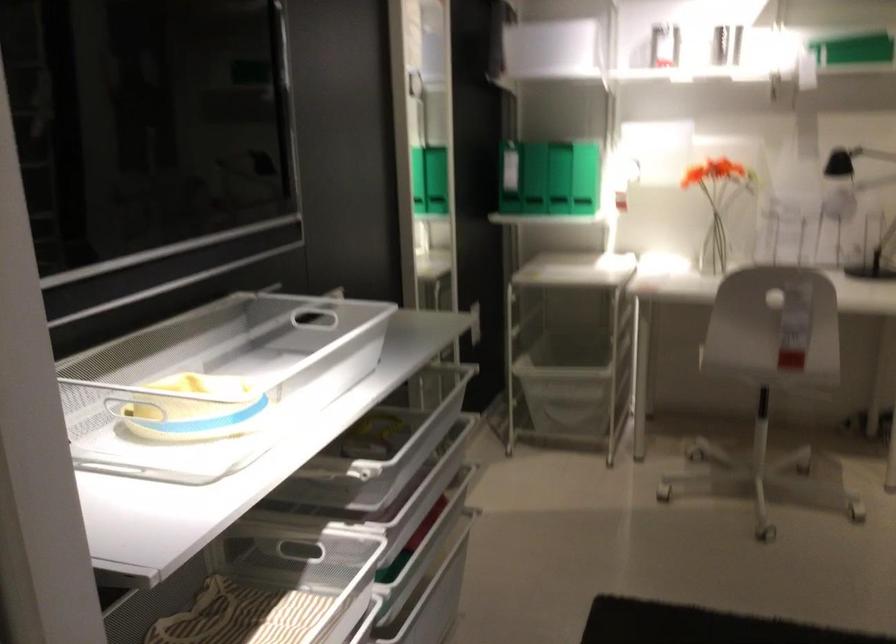
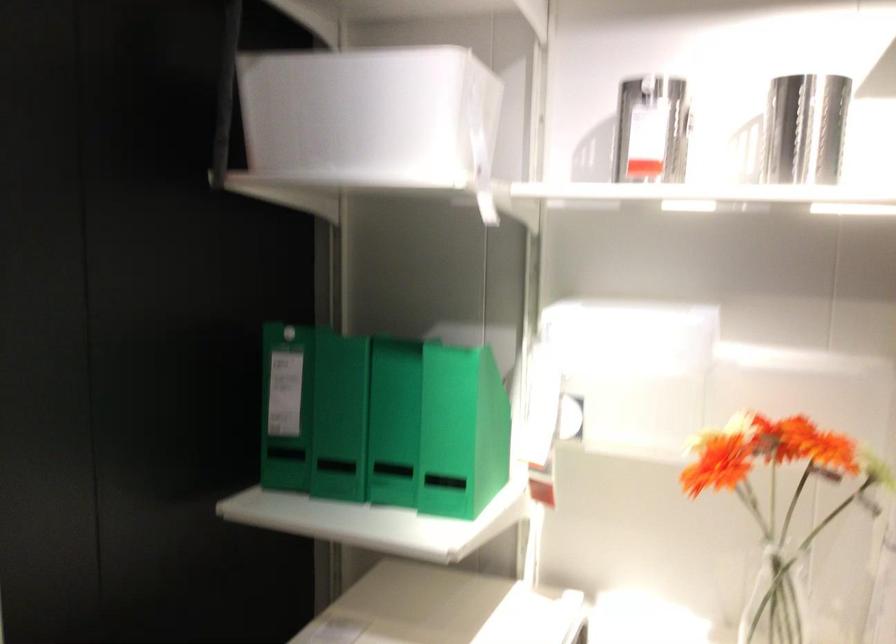
Question: In a continuous first-person perspective shot, in which direction is the camera moving?

Choices:
 (A) Left
 (B) Right
 (C) Forward
 (D) Backward

Answer: (C)